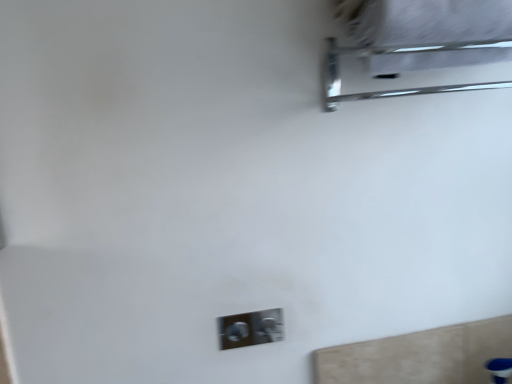
Question: Considering the relative sizes of metallic chrome towel rack at upper right and satin silver switch at lower center in the image provided, is metallic chrome towel rack at upper right smaller than satin silver switch at lower center?

Choices:
 (A) no
 (B) yes

Answer: (A)

Question: Is metallic chrome towel rack at upper right looking in the opposite direction of satin silver switch at lower center?

Choices:
 (A) no
 (B) yes

Answer: (A)

Question: From a real-world perspective, is metallic chrome towel rack at upper right beneath satin silver switch at lower center?

Choices:
 (A) yes
 (B) no

Answer: (B)

Question: Is metallic chrome towel rack at upper right aimed at satin silver switch at lower center?

Choices:
 (A) no
 (B) yes

Answer: (A)

Question: Does metallic chrome towel rack at upper right lie in front of satin silver switch at lower center?

Choices:
 (A) no
 (B) yes

Answer: (B)

Question: From a real-world perspective, is metallic chrome towel rack at upper right located higher than satin silver switch at lower center?

Choices:
 (A) yes
 (B) no

Answer: (A)

Question: Considering the relative sizes of satin silver switch at lower center and metallic chrome towel rack at upper right in the image provided, is satin silver switch at lower center thinner than metallic chrome towel rack at upper right?

Choices:
 (A) no
 (B) yes

Answer: (B)

Question: Could you tell me if satin silver switch at lower center is facing metallic chrome towel rack at upper right?

Choices:
 (A) no
 (B) yes

Answer: (A)

Question: Is satin silver switch at lower center beside metallic chrome towel rack at upper right?

Choices:
 (A) no
 (B) yes

Answer: (A)

Question: Is satin silver switch at lower center taller than metallic chrome towel rack at upper right?

Choices:
 (A) yes
 (B) no

Answer: (B)

Question: Considering the relative sizes of satin silver switch at lower center and metallic chrome towel rack at upper right in the image provided, is satin silver switch at lower center smaller than metallic chrome towel rack at upper right?

Choices:
 (A) no
 (B) yes

Answer: (B)

Question: Does satin silver switch at lower center have a greater width compared to metallic chrome towel rack at upper right?

Choices:
 (A) no
 (B) yes

Answer: (A)

Question: From the image's perspective, is metallic chrome towel rack at upper right positioned above or below satin silver switch at lower center?

Choices:
 (A) below
 (B) above

Answer: (B)